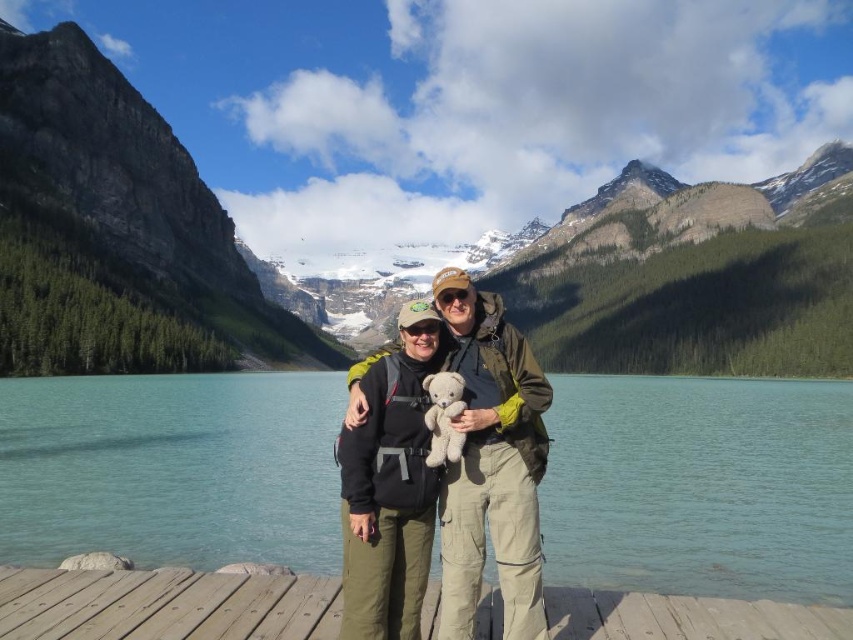
Is point (202, 332) in front of point (424, 461)?

No, (202, 332) is behind (424, 461).

How far apart are rocky gray mountain at left and white plush bear at center?

rocky gray mountain at left is 219.53 meters from white plush bear at center.

Image resolution: width=853 pixels, height=640 pixels. Find the location of `rocky gray mountain at left`. rocky gray mountain at left is located at coordinates (117, 232).

Which of these two, wooden dock at center or white plush bear at center, stands taller?

With more height is white plush bear at center.

Is wooden dock at center wider than white plush bear at center?

Correct, the width of wooden dock at center exceeds that of white plush bear at center.

Which is in front, point (422, 621) or point (442, 392)?

Point (422, 621) is in front.

Find the location of a particular element. The height and width of the screenshot is (640, 853). wooden dock at center is located at coordinates (164, 605).

Who is shorter, green rock mountain at center or beige fabric teddy bear at center?

With less height is beige fabric teddy bear at center.

Does green rock mountain at center appear on the right side of beige fabric teddy bear at center?

Yes, green rock mountain at center is to the right of beige fabric teddy bear at center.

Is point (639, 298) in front of point (482, 381)?

No.

Where is `green rock mountain at center`? green rock mountain at center is located at coordinates click(480, 192).